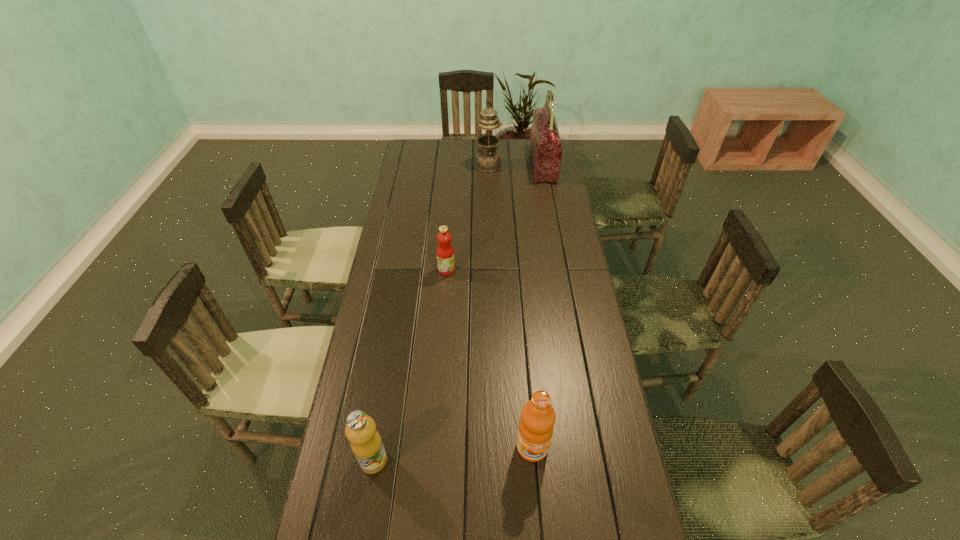
Image resolution: width=960 pixels, height=540 pixels. In order to click on vacant space located 0.210m on the front of the oil lamp in this screenshot , I will do 489,199.

The height and width of the screenshot is (540, 960). In order to click on vacant space located 0.100m on the label side of the rightmost fruit juice in this screenshot , I will do `click(537, 504)`.

I want to click on free space located on the front label of the leftmost object, so click(x=437, y=460).

You are a GUI agent. You are given a task and a screenshot of the screen. Output one action in this format:
    pyautogui.click(x=<x>, y=<y>)
    Task: Click on the vacant space situated on the front label of the third farthest object
    Image resolution: width=960 pixels, height=540 pixels.
    Given the screenshot: What is the action you would take?
    pyautogui.click(x=515, y=270)

You are a GUI agent. You are given a task and a screenshot of the screen. Output one action in this format:
    pyautogui.click(x=<x>, y=<y>)
    Task: Click on the handbag that is at the far edge
    
    Given the screenshot: What is the action you would take?
    pyautogui.click(x=545, y=144)

The width and height of the screenshot is (960, 540). In order to click on oil lamp present at the far edge in this screenshot , I will do `click(488, 160)`.

Identify the location of object situated at the left edge. Image resolution: width=960 pixels, height=540 pixels. (366, 443).

Locate an element on the screen. The image size is (960, 540). object that is at the right edge is located at coordinates (545, 144).

Find the location of `object present at the far right corner`. object present at the far right corner is located at coordinates (545, 144).

This screenshot has width=960, height=540. In order to click on free space at the left edge of the desktop in this screenshot , I will do `click(396, 459)`.